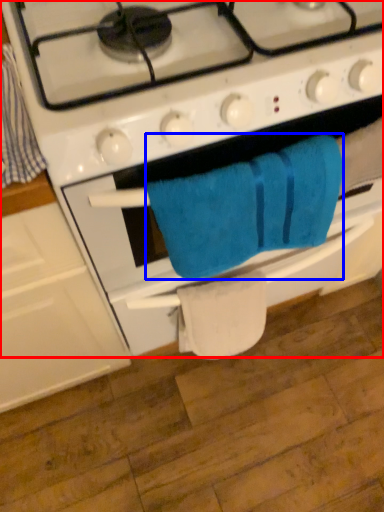
Question: Which point is closer to the camera, gas stove (highlighted by a red box) or towel/napkin (highlighted by a blue box)?

Choices:
 (A) gas stove
 (B) towel/napkin

Answer: (A)